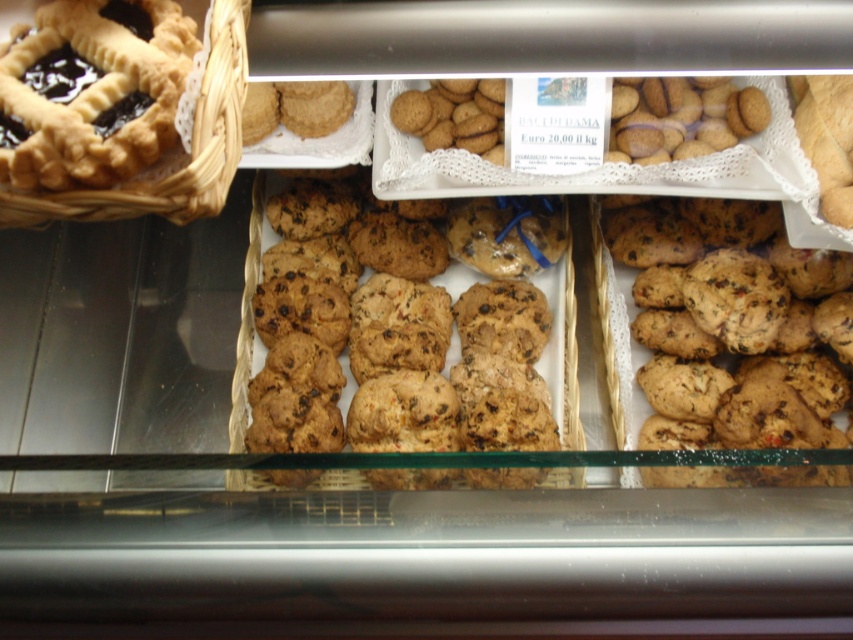
Which of these two, brown crumbly cookie at center or woven brown basket at upper left, stands shorter?

Standing shorter between the two is woven brown basket at upper left.

Is brown crumbly cookie at center above woven brown basket at upper left?

Actually, brown crumbly cookie at center is below woven brown basket at upper left.

Find the location of a particular element. The image size is (853, 640). brown crumbly cookie at center is located at coordinates (724, 333).